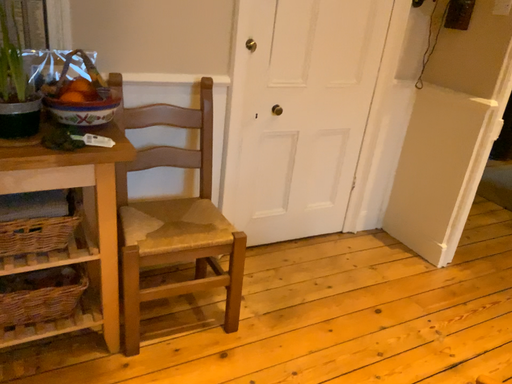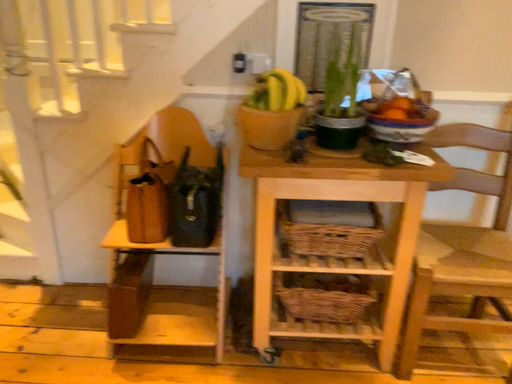
Question: How did the camera likely rotate when shooting the video?

Choices:
 (A) rotated right
 (B) rotated left

Answer: (B)